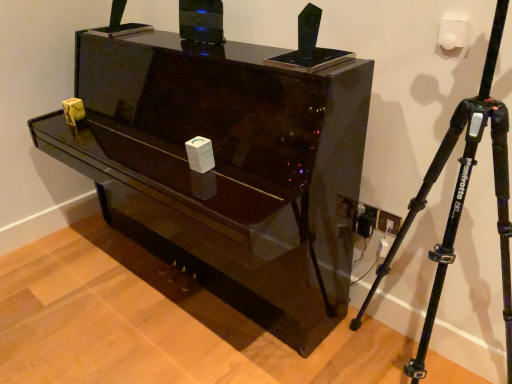
Question: Relative to glossy black piano at center, is black matte tripod at right in front or behind?

Choices:
 (A) front
 (B) behind

Answer: (A)

Question: Is black matte tripod at right wider or thinner than glossy black piano at center?

Choices:
 (A) wide
 (B) thin

Answer: (B)

Question: From the image's perspective, relative to glossy black piano at center, is black matte tripod at right above or below?

Choices:
 (A) below
 (B) above

Answer: (A)

Question: In terms of width, does glossy black piano at center look wider or thinner when compared to black matte tripod at right?

Choices:
 (A) wide
 (B) thin

Answer: (A)

Question: Choose the correct answer: Is glossy black piano at center inside black matte tripod at right or outside it?

Choices:
 (A) inside
 (B) outside

Answer: (B)

Question: From a real-world perspective, is glossy black piano at center physically located above or below black matte tripod at right?

Choices:
 (A) below
 (B) above

Answer: (A)

Question: Relative to black matte tripod at right, is glossy black piano at center in front or behind?

Choices:
 (A) front
 (B) behind

Answer: (B)